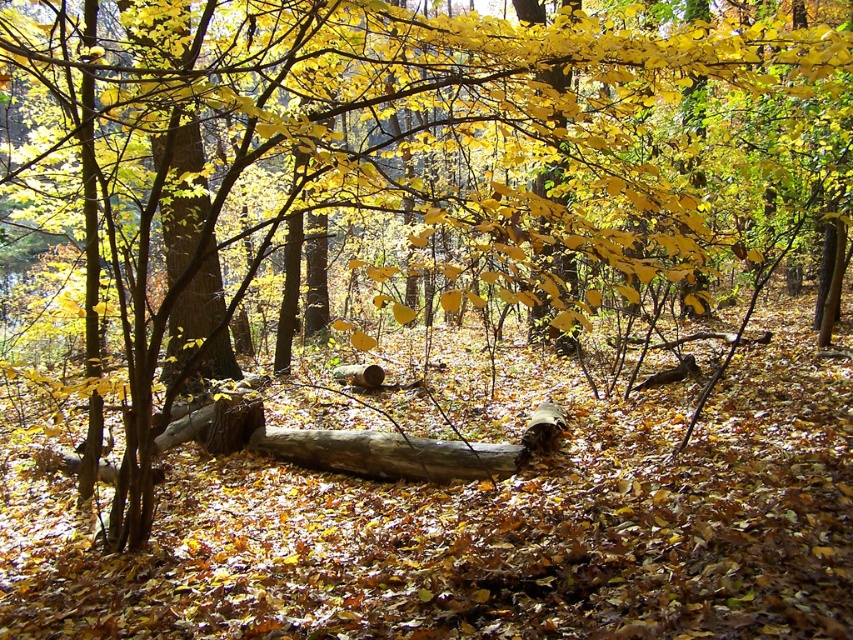
Which is behind, point (218, 262) or point (509, 451)?

Point (218, 262)

Can you confirm if brown rough tree trunk at center is shorter than smooth brown log at center?

Yes, brown rough tree trunk at center is shorter than smooth brown log at center.

Between point (190, 134) and point (408, 476), which one is positioned behind?

Point (190, 134)

Locate an element on the screen. The height and width of the screenshot is (640, 853). brown rough tree trunk at center is located at coordinates (183, 198).